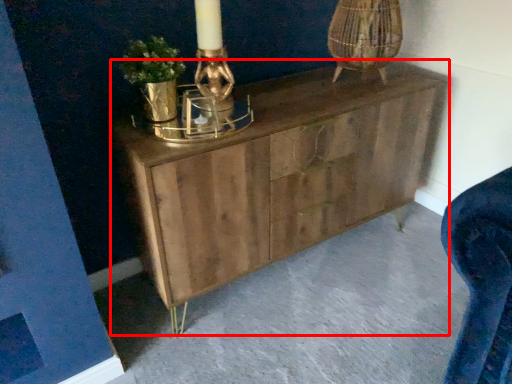
Question: Considering the relative positions of chest of drawers (annotated by the red box) and concrete in the image provided, where is chest of drawers (annotated by the red box) located with respect to the staircase?

Choices:
 (A) left
 (B) right

Answer: (A)